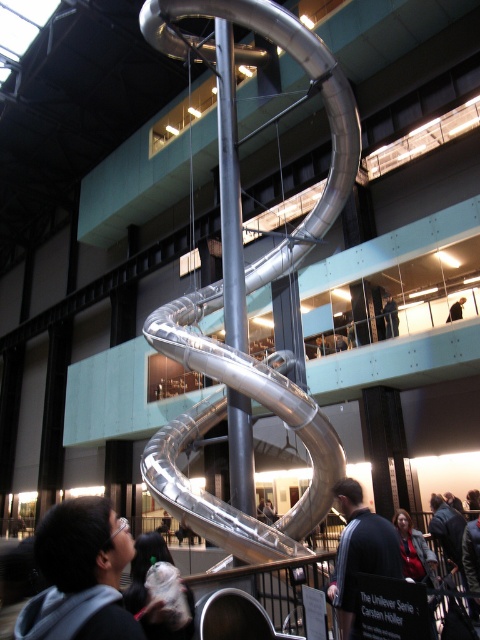
Question: Which object is positioned closest to the white cotton hoodie at lower left?

Choices:
 (A) dark gray jacket at upper center
 (B) dark blue shirt at upper center
 (C) dark gray fabric jacket at center
 (D) red sweater at lower right

Answer: (C)

Question: Among these points, which one is farthest from the camera?

Choices:
 (A) (385, 304)
 (B) (448, 310)

Answer: (A)

Question: Is dark gray hoodie at lower left bigger than dark gray jacket at upper center?

Choices:
 (A) no
 (B) yes

Answer: (A)

Question: Which point is farther to the camera?

Choices:
 (A) (408, 544)
 (B) (167, 556)
 (C) (330, 595)

Answer: (A)

Question: Can you confirm if red sweater at lower right is positioned to the left of dark gray jacket at upper center?

Choices:
 (A) no
 (B) yes

Answer: (B)

Question: Is white cotton hoodie at lower left above red sweater at lower right?

Choices:
 (A) yes
 (B) no

Answer: (A)